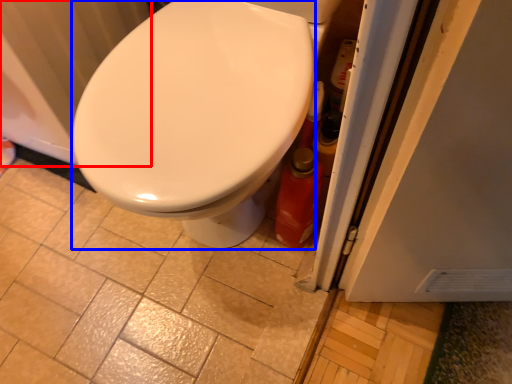
Question: Which point is closer to the camera, radiator (highlighted by a red box) or bidet (highlighted by a blue box)?

Choices:
 (A) radiator
 (B) bidet

Answer: (B)